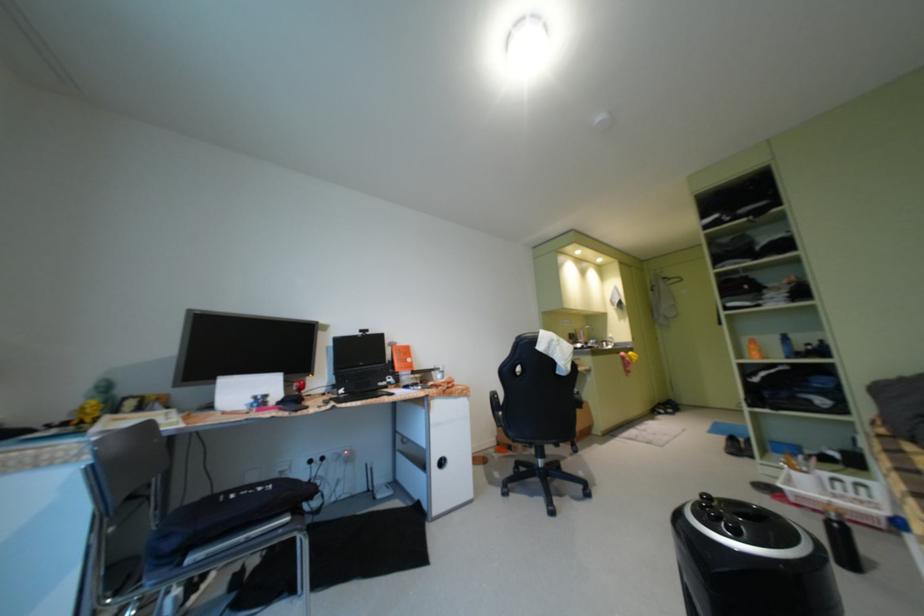
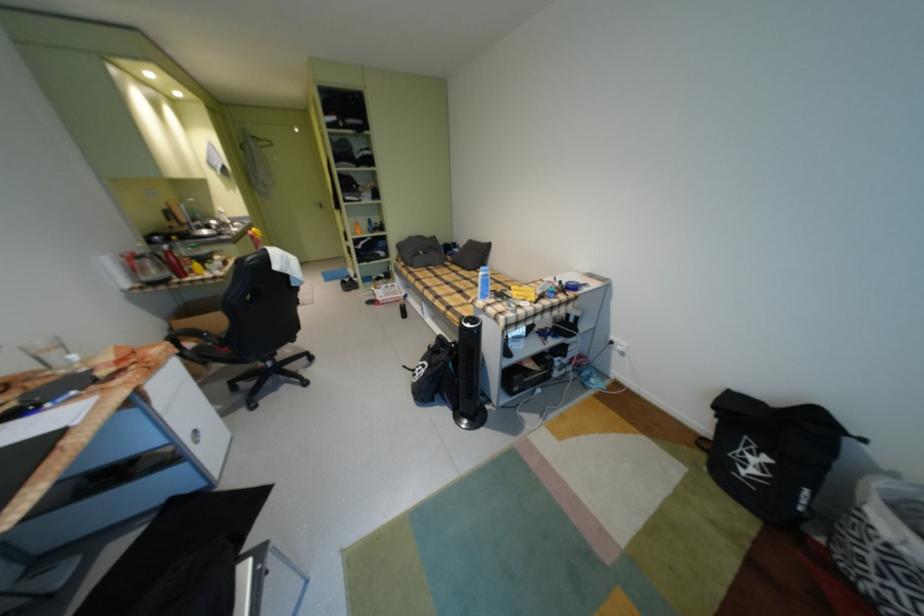
Locate, in the second image, the point that corresponds to point (894, 432) in the first image.

(412, 265)